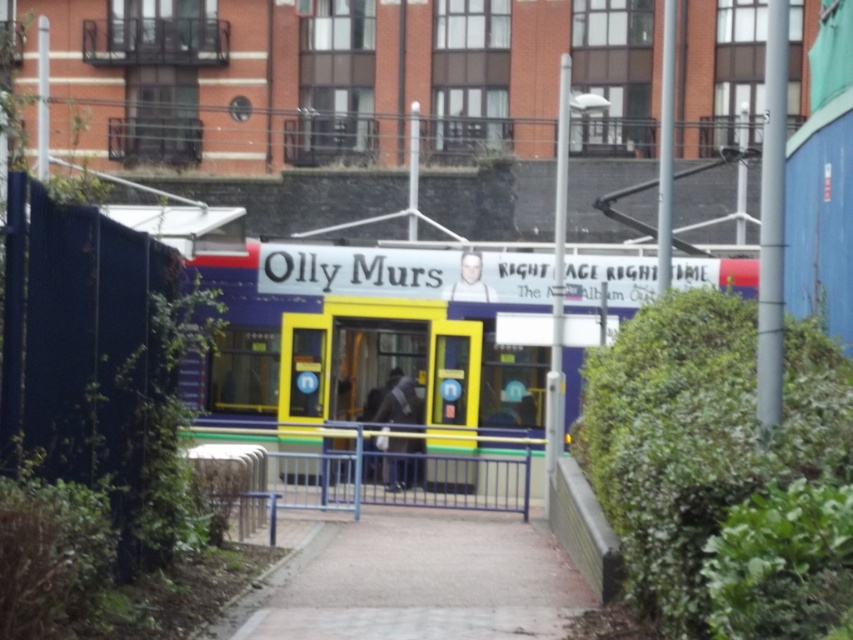
Question: Which point is closer to the camera?

Choices:
 (A) pyautogui.click(x=286, y=289)
 (B) pyautogui.click(x=519, y=579)
 (C) pyautogui.click(x=291, y=483)

Answer: (B)

Question: Considering the real-world distances, which object is closest to the paved concrete pavement at center?

Choices:
 (A) blue metallic rail at center
 (B) yellow plastic train at center

Answer: (A)

Question: Can you confirm if paved concrete pavement at center is smaller than blue metallic rail at center?

Choices:
 (A) yes
 (B) no

Answer: (B)

Question: Which object appears closest to the camera in this image?

Choices:
 (A) yellow plastic train at center
 (B) blue metallic rail at center
 (C) paved concrete pavement at center

Answer: (C)

Question: Is yellow plastic train at center to the left of paved concrete pavement at center from the viewer's perspective?

Choices:
 (A) no
 (B) yes

Answer: (A)

Question: Can you confirm if yellow plastic train at center is positioned to the right of paved concrete pavement at center?

Choices:
 (A) yes
 (B) no

Answer: (A)